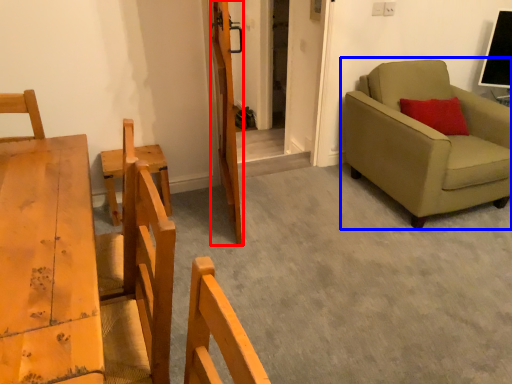
Question: Which point is closer to the camera, door (highlighted by a red box) or studio couch (highlighted by a blue box)?

Choices:
 (A) door
 (B) studio couch

Answer: (A)